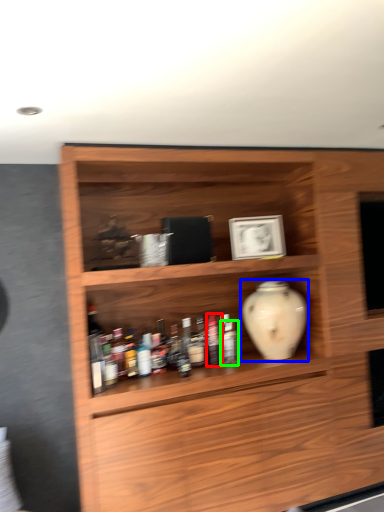
Question: Based on their relative distances, which object is farther from bottle (highlighted by a red box)? Choose from vase (highlighted by a blue box) and bottle (highlighted by a green box).

Choices:
 (A) vase
 (B) bottle

Answer: (A)